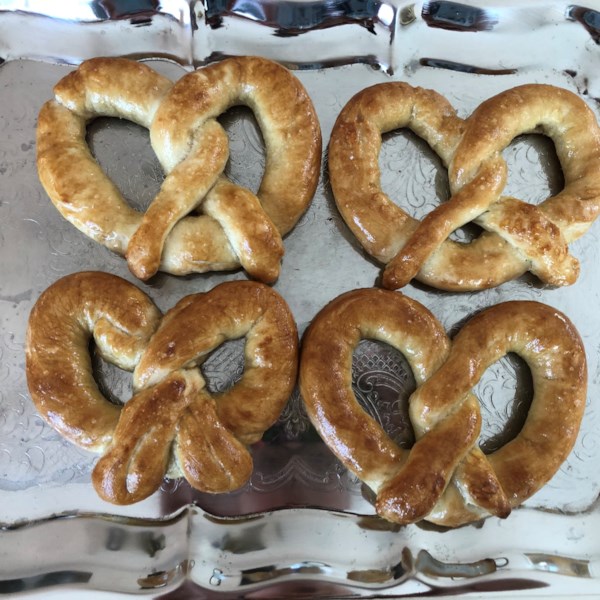
At what (x,y) coordinates should I click in order to perform the action: click on metal silver serving tray. Please return your answer as a coordinate pair (x, y). The height and width of the screenshot is (600, 600). Looking at the image, I should click on (299, 527).